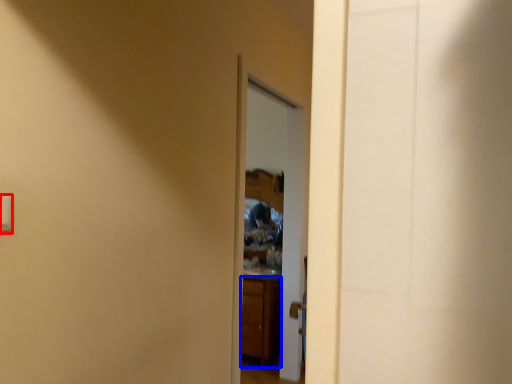
Question: Which of the following is the closest to the observer, light switch (highlighted by a red box) or cabinetry (highlighted by a blue box)?

Choices:
 (A) light switch
 (B) cabinetry

Answer: (A)